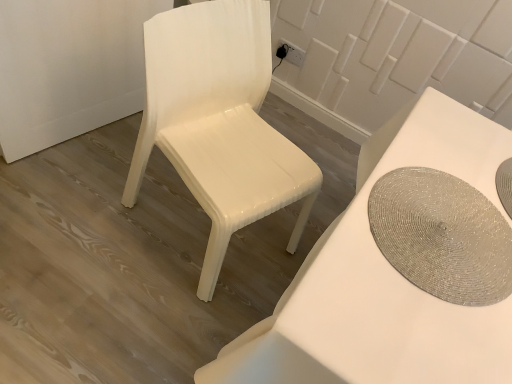
Image resolution: width=512 pixels, height=384 pixels. I want to click on vacant area that is in front of white glossy chair at left, so click(133, 308).